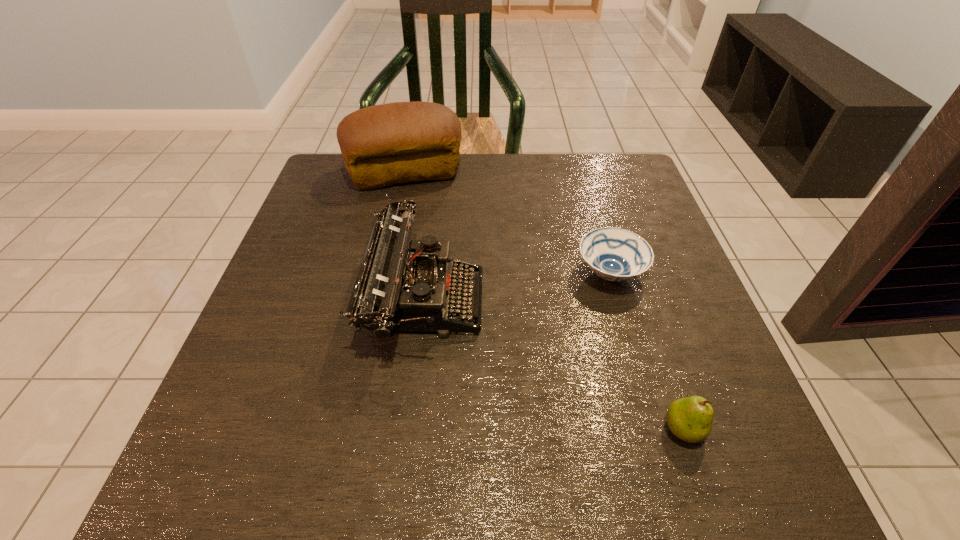
Where is `object that is at the far edge`? object that is at the far edge is located at coordinates (382, 145).

Find the location of a particular element. object positioned at the near edge is located at coordinates (690, 419).

Locate an element on the screen. Image resolution: width=960 pixels, height=540 pixels. object that is at the left edge is located at coordinates coord(382,145).

The image size is (960, 540). What are the coordinates of `pear present at the right edge` in the screenshot? It's located at (690, 419).

At what (x,y) coordinates should I click in order to perform the action: click on soup bowl present at the right edge. Please return your answer as a coordinate pair (x, y). The height and width of the screenshot is (540, 960). Looking at the image, I should click on (614, 254).

The height and width of the screenshot is (540, 960). What are the coordinates of `object located in the far left corner section of the desktop` in the screenshot? It's located at (382, 145).

Where is `object at the near right corner`? object at the near right corner is located at coordinates (690, 419).

Image resolution: width=960 pixels, height=540 pixels. In the image, there is a desktop. What are the coordinates of `free space at the far edge` in the screenshot? It's located at (472, 186).

Where is `free region at the near edge of the desktop`? This screenshot has height=540, width=960. free region at the near edge of the desktop is located at coordinates (319, 493).

This screenshot has width=960, height=540. In the image, there is a desktop. In order to click on vacant space at the right edge in this screenshot , I will do point(735,408).